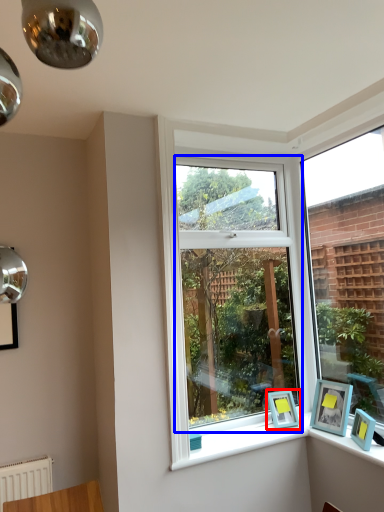
Question: Which of the following is the closest to the observer, picture frame (highlighted by a red box) or window (highlighted by a blue box)?

Choices:
 (A) picture frame
 (B) window

Answer: (B)